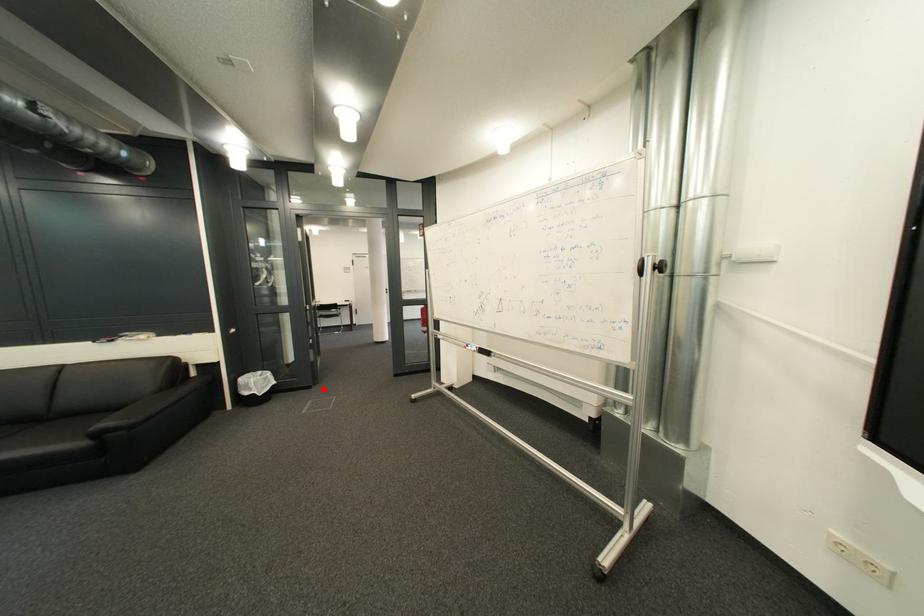
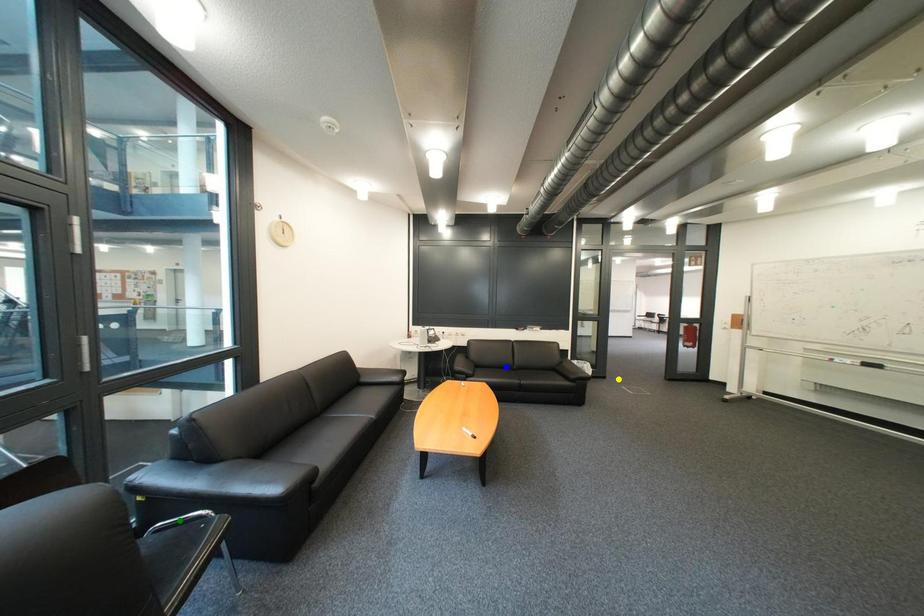
Question: I am providing you with two images of the same scene from different viewpoints. A red point is marked on the first image. You are given multiple points on the second image. Which point in image 2 is actually the same real-world point as the red point in image 1?

Choices:
 (A) yellow point
 (B) green point
 (C) blue point

Answer: (A)